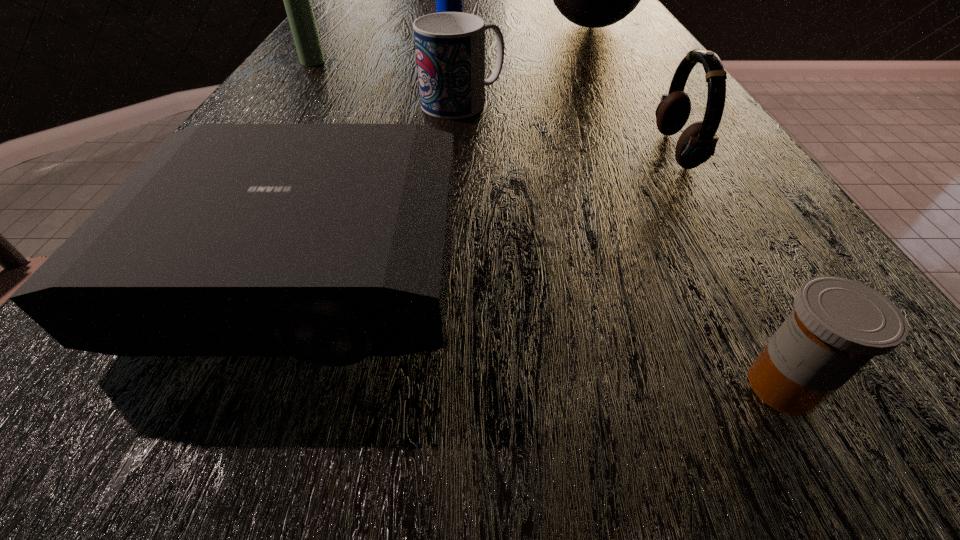
Locate an element on the screen. The image size is (960, 540). vacant area situated on the ear cup of the third nearest object is located at coordinates (424, 151).

The height and width of the screenshot is (540, 960). What are the coordinates of `vacant space located 0.060m on the ear cup of the third nearest object` in the screenshot? It's located at (624, 151).

You are a GUI agent. You are given a task and a screenshot of the screen. Output one action in this format:
    pyautogui.click(x=<x>, y=<y>)
    Task: Click on the vacant space located on the ear cup of the third nearest object
    
    Given the screenshot: What is the action you would take?
    631,151

At what (x,y) coordinates should I click in order to perform the action: click on blank space located 0.260m on the right of the fourth nearest object. Please return your answer as a coordinate pair (x, y). The image size is (960, 540). Looking at the image, I should click on (638, 103).

Locate an element on the screen. free space located 0.060m on the front-facing side of the projector is located at coordinates (238, 434).

Find the location of `vacant position located 0.190m on the label of the medicine`. vacant position located 0.190m on the label of the medicine is located at coordinates (547, 386).

Where is `vacant space located on the label of the medicine`? vacant space located on the label of the medicine is located at coordinates (361, 386).

This screenshot has width=960, height=540. I want to click on vacant area situated 0.060m on the label of the medicine, so click(x=683, y=386).

The width and height of the screenshot is (960, 540). In order to click on object located in the far edge section of the desktop in this screenshot , I will do `click(594, 0)`.

You are a GUI agent. You are given a task and a screenshot of the screen. Output one action in this format:
    pyautogui.click(x=<x>, y=<y>)
    Task: Click on the thermos bottle positioned at the left edge
    
    Given the screenshot: What is the action you would take?
    (x=297, y=0)